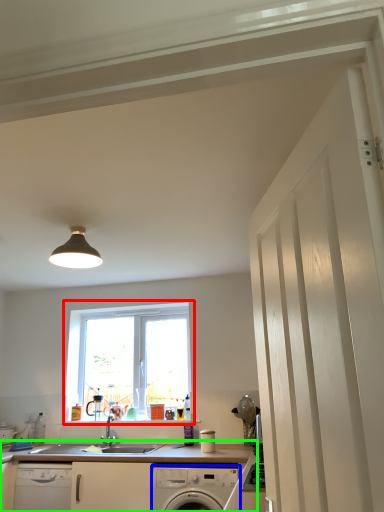
Question: Which is nearer to the window (highlighted by a red box)? home appliance (highlighted by a blue box) or countertop (highlighted by a green box).

Choices:
 (A) home appliance
 (B) countertop

Answer: (B)